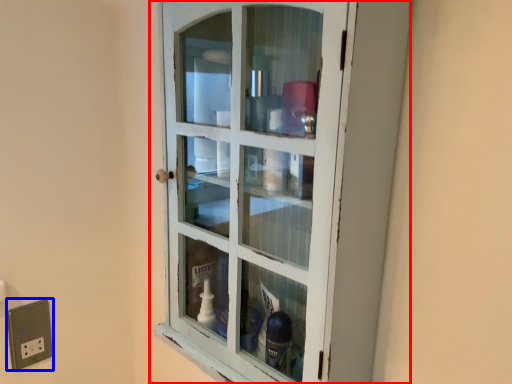
Question: Which point is closer to the camera, cupboard (highlighted by a red box) or electric outlet (highlighted by a blue box)?

Choices:
 (A) cupboard
 (B) electric outlet

Answer: (A)